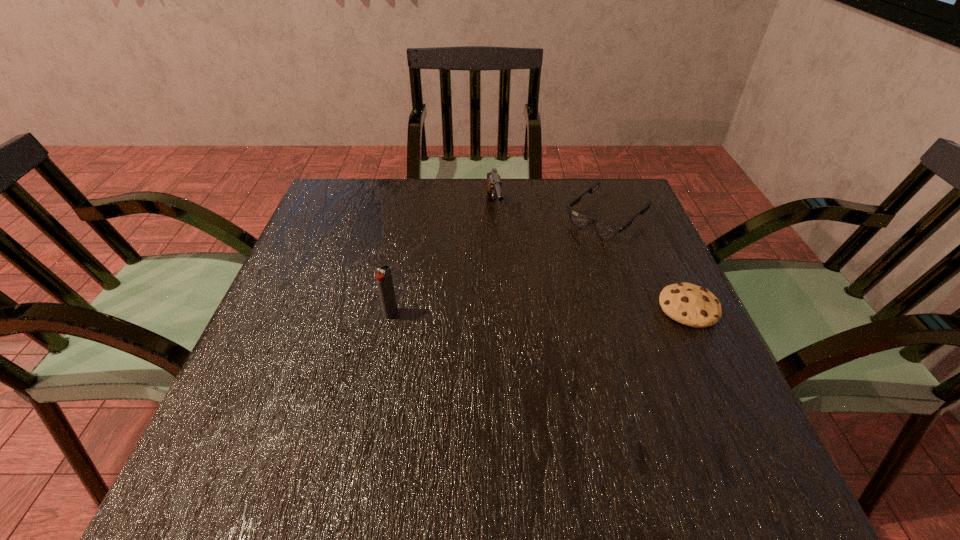
This screenshot has width=960, height=540. I want to click on vacant space at the far left corner, so click(348, 210).

At what (x,y) coordinates should I click in order to perform the action: click on free space at the far right corner of the desktop. Please return your answer as a coordinate pair (x, y). Looking at the image, I should click on coord(578,185).

The width and height of the screenshot is (960, 540). Find the location of `blank region between the shortest object and the igniter`. blank region between the shortest object and the igniter is located at coordinates (x=540, y=311).

You are a GUI agent. You are given a task and a screenshot of the screen. Output one action in this format:
    pyautogui.click(x=<x>, y=<y>)
    Task: Click on the free space between the igniter and the sunglasses
    Image resolution: width=960 pixels, height=540 pixels.
    Given the screenshot: What is the action you would take?
    pyautogui.click(x=498, y=266)

You are a GUI agent. You are given a task and a screenshot of the screen. Output one action in this format:
    pyautogui.click(x=<x>, y=<y>)
    Task: Click on the vacant area that lies between the shortest object and the igniter
    This screenshot has width=960, height=540.
    Given the screenshot: What is the action you would take?
    pyautogui.click(x=540, y=311)

Find the location of a particular element. This screenshot has height=540, width=960. free point between the third object from right to left and the leftmost object is located at coordinates (442, 263).

In order to click on free spot between the sunglasses and the third object from right to left in this screenshot , I will do `click(549, 215)`.

The width and height of the screenshot is (960, 540). Find the location of `empty location between the pistol and the cookie`. empty location between the pistol and the cookie is located at coordinates (591, 260).

Where is `empty location between the sunglasses and the cookie`? empty location between the sunglasses and the cookie is located at coordinates (647, 264).

In order to click on free space that is in between the igniter and the pistol in this screenshot , I will do `click(442, 263)`.